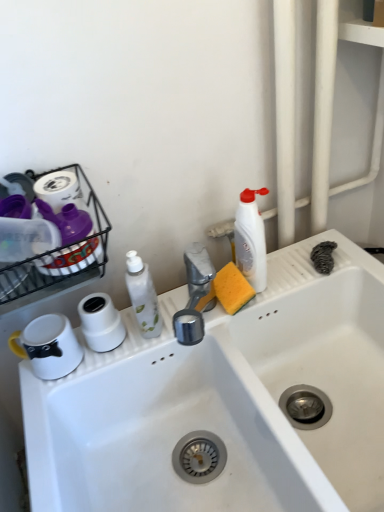
Where is `free space to the right of white glossy mug at left`? Image resolution: width=384 pixels, height=512 pixels. free space to the right of white glossy mug at left is located at coordinates (125, 345).